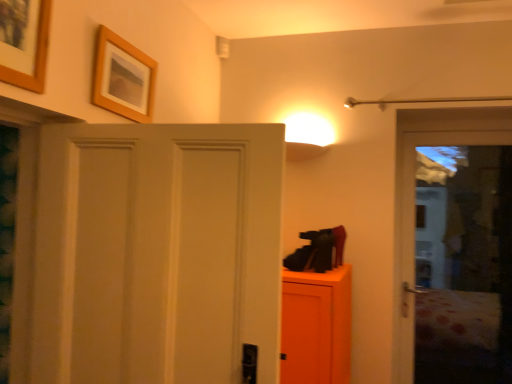
Question: Is wooden frame at upper left, the 2th picture frame from the front, looking in the opposite direction of wooden picture frame at upper left, positioned as the second picture frame in back-to-front order?

Choices:
 (A) no
 (B) yes

Answer: (A)

Question: From the image's perspective, is wooden frame at upper left, the 2th picture frame from the front, located beneath wooden picture frame at upper left, which is the 1th picture frame in left-to-right order?

Choices:
 (A) no
 (B) yes

Answer: (B)

Question: Can you confirm if wooden frame at upper left, arranged as the 1th picture frame when viewed from the right, is shorter than wooden picture frame at upper left, positioned as the second picture frame in back-to-front order?

Choices:
 (A) yes
 (B) no

Answer: (A)

Question: From the image's perspective, would you say wooden frame at upper left, the 2th picture frame from the front, is positioned over wooden picture frame at upper left, positioned as the second picture frame in right-to-left order?

Choices:
 (A) no
 (B) yes

Answer: (A)

Question: Is wooden frame at upper left, the second picture frame positioned from the left, at the left side of wooden picture frame at upper left, positioned as the second picture frame in back-to-front order?

Choices:
 (A) yes
 (B) no

Answer: (B)

Question: Could you tell me if wooden frame at upper left, arranged as the 1th picture frame when viewed from the right, is facing wooden picture frame at upper left, which is the 1th picture frame in left-to-right order?

Choices:
 (A) yes
 (B) no

Answer: (B)

Question: Can you confirm if wooden picture frame at upper left, positioned as the second picture frame in back-to-front order, is bigger than wooden frame at upper left, arranged as the 1th picture frame when viewed from the right?

Choices:
 (A) no
 (B) yes

Answer: (B)

Question: Is wooden picture frame at upper left, placed as the 1th picture frame when sorted from front to back, shorter than wooden frame at upper left, which ranks as the first picture frame in back-to-front order?

Choices:
 (A) yes
 (B) no

Answer: (B)

Question: From the image's perspective, is wooden picture frame at upper left, placed as the 1th picture frame when sorted from front to back, located beneath wooden frame at upper left, the 2th picture frame from the front?

Choices:
 (A) no
 (B) yes

Answer: (A)

Question: Is the depth of wooden picture frame at upper left, positioned as the second picture frame in back-to-front order, greater than that of wooden frame at upper left, the second picture frame positioned from the left?

Choices:
 (A) yes
 (B) no

Answer: (B)

Question: From a real-world perspective, is wooden picture frame at upper left, placed as the 1th picture frame when sorted from front to back, located higher than wooden frame at upper left, the second picture frame positioned from the left?

Choices:
 (A) no
 (B) yes

Answer: (B)

Question: Is wooden picture frame at upper left, placed as the 1th picture frame when sorted from front to back, positioned far away from wooden frame at upper left, the second picture frame positioned from the left?

Choices:
 (A) no
 (B) yes

Answer: (A)

Question: Is wooden picture frame at upper left, which is the 1th picture frame in left-to-right order, spatially inside wooden frame at upper left, the second picture frame positioned from the left, or outside of it?

Choices:
 (A) outside
 (B) inside

Answer: (A)